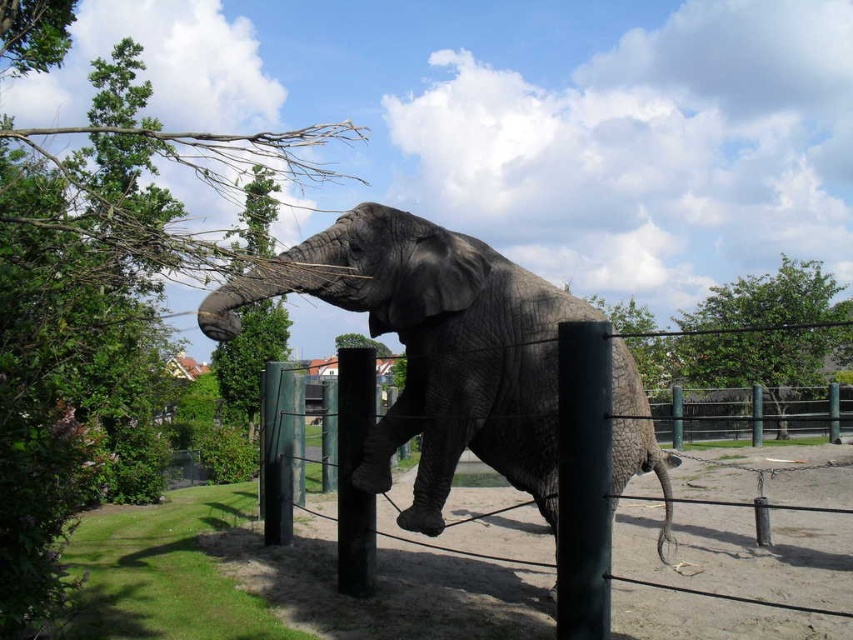
You are a visitor at the zoo and want to take a photo of the green leafy tree at upper right and the green painted metal pole at right. Which object will appear bigger in your photo?

The green leafy tree at upper right will appear bigger in the photo because it has a larger size compared to the green painted metal pole at right.

Looking at this image, you are a zookeeper who wants to secure the elephant sculpture with a chain. You have a chain that can wrap around the green painted metal pole at right once. Can you use the same chain to secure the green painted metal fence at center instead?

The green painted metal fence at center might be wider than green painted metal pole at right, so the chain that fits around the green painted metal pole at right once may not be long enough to secure the green painted metal fence at center.